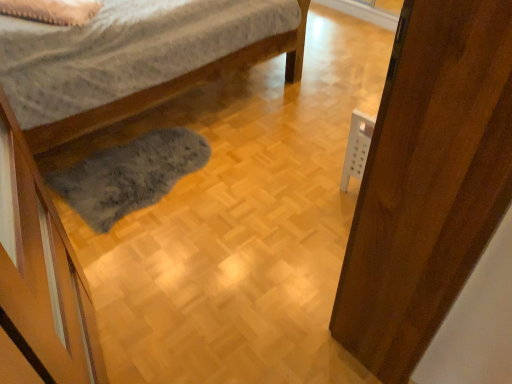
Question: Can you confirm if wooden door at right is bigger than white soft pillow at upper left?

Choices:
 (A) no
 (B) yes

Answer: (B)

Question: Considering the relative sizes of wooden door at right and white soft pillow at upper left in the image provided, is wooden door at right shorter than white soft pillow at upper left?

Choices:
 (A) no
 (B) yes

Answer: (A)

Question: Is wooden door at right facing away from white soft pillow at upper left?

Choices:
 (A) yes
 (B) no

Answer: (B)

Question: Are wooden door at right and white soft pillow at upper left making contact?

Choices:
 (A) no
 (B) yes

Answer: (A)

Question: Is wooden door at right oriented towards white soft pillow at upper left?

Choices:
 (A) no
 (B) yes

Answer: (A)

Question: Considering the relative sizes of wooden door at right and white soft pillow at upper left in the image provided, is wooden door at right wider than white soft pillow at upper left?

Choices:
 (A) yes
 (B) no

Answer: (B)

Question: Is white soft pillow at upper left wider than wooden door at right?

Choices:
 (A) yes
 (B) no

Answer: (A)

Question: Considering the relative positions of white soft pillow at upper left and wooden door at right in the image provided, is white soft pillow at upper left behind wooden door at right?

Choices:
 (A) yes
 (B) no

Answer: (A)

Question: Can you confirm if white soft pillow at upper left is shorter than wooden door at right?

Choices:
 (A) no
 (B) yes

Answer: (B)

Question: From a real-world perspective, is white soft pillow at upper left located higher than wooden door at right?

Choices:
 (A) no
 (B) yes

Answer: (B)

Question: Would you say white soft pillow at upper left contains wooden door at right?

Choices:
 (A) no
 (B) yes

Answer: (A)

Question: From the image's perspective, is white soft pillow at upper left located above wooden door at right?

Choices:
 (A) no
 (B) yes

Answer: (B)

Question: In terms of height, does white soft pillow at upper left look taller or shorter compared to wooden door at right?

Choices:
 (A) short
 (B) tall

Answer: (A)